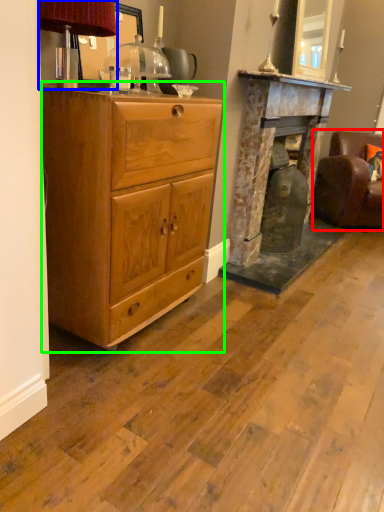
Question: Estimate the real-world distances between objects in this image. Which object is closer to swivel chair (highlighted by a red box), table lamp (highlighted by a blue box) or chest of drawers (highlighted by a green box)?

Choices:
 (A) table lamp
 (B) chest of drawers

Answer: (B)